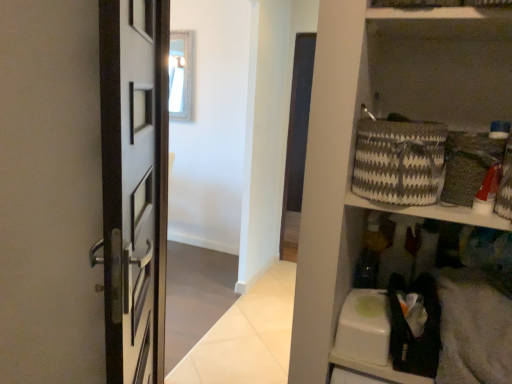
Question: Does wooden frame mirror at upper center lie in front of gray and white woven basket at upper right?

Choices:
 (A) yes
 (B) no

Answer: (B)

Question: From the image's perspective, is wooden frame mirror at upper center on gray and white woven basket at upper right?

Choices:
 (A) no
 (B) yes

Answer: (B)

Question: Is the depth of wooden frame mirror at upper center greater than that of gray and white woven basket at upper right?

Choices:
 (A) yes
 (B) no

Answer: (A)

Question: From the image's perspective, would you say wooden frame mirror at upper center is shown under gray and white woven basket at upper right?

Choices:
 (A) yes
 (B) no

Answer: (B)

Question: Is gray and white woven basket at upper right inside wooden frame mirror at upper center?

Choices:
 (A) yes
 (B) no

Answer: (B)

Question: Can you confirm if wooden frame mirror at upper center is thinner than gray and white woven basket at upper right?

Choices:
 (A) no
 (B) yes

Answer: (B)

Question: Does wooden frame mirror at upper center appear on the right side of white glossy wall at upper center?

Choices:
 (A) no
 (B) yes

Answer: (A)

Question: Could you tell me if wooden frame mirror at upper center is facing white glossy wall at upper center?

Choices:
 (A) yes
 (B) no

Answer: (B)

Question: Considering the relative sizes of wooden frame mirror at upper center and white glossy wall at upper center in the image provided, is wooden frame mirror at upper center taller than white glossy wall at upper center?

Choices:
 (A) no
 (B) yes

Answer: (A)

Question: Is wooden frame mirror at upper center at the left side of white glossy wall at upper center?

Choices:
 (A) yes
 (B) no

Answer: (A)

Question: Is wooden frame mirror at upper center smaller than white glossy wall at upper center?

Choices:
 (A) yes
 (B) no

Answer: (A)

Question: Is white glossy wall at upper center located within wooden frame mirror at upper center?

Choices:
 (A) yes
 (B) no

Answer: (B)

Question: Does gray and white woven basket at upper right have a greater width compared to wooden frame mirror at upper center?

Choices:
 (A) yes
 (B) no

Answer: (A)